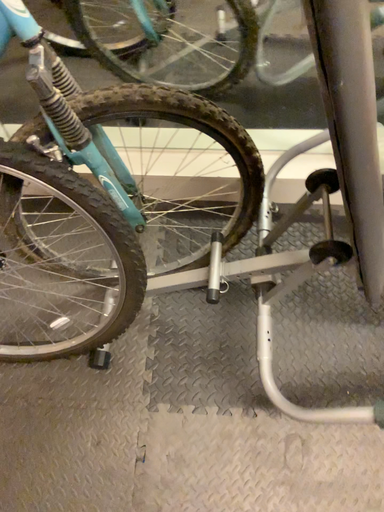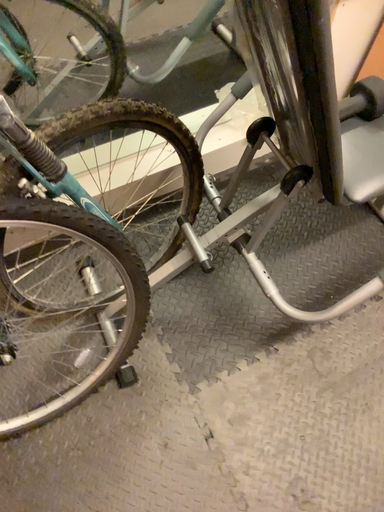
Question: Which way did the camera rotate in the video?

Choices:
 (A) rotated right
 (B) rotated left

Answer: (A)